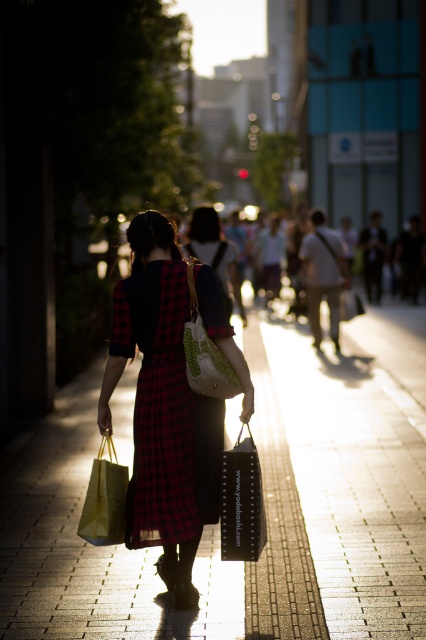
Question: Among these objects, which one is farthest from the camera?

Choices:
 (A) green textured fabric handbag at center
 (B) yellow paper shopping bag at lower left

Answer: (A)

Question: Which point is farther to the camera?

Choices:
 (A) red plaid dress at center
 (B) brick pavement at center
 (C) green textured fabric handbag at center

Answer: (A)

Question: In this image, where is red plaid dress at center located relative to yellow paper shopping bag at lower left?

Choices:
 (A) left
 (B) right

Answer: (B)

Question: Which object appears farthest from the camera in this image?

Choices:
 (A) black matte shopping bag at center
 (B) yellow paper shopping bag at lower left

Answer: (B)

Question: Can you confirm if brick pavement at center is positioned above green textured fabric handbag at center?

Choices:
 (A) no
 (B) yes

Answer: (A)

Question: Does black matte shopping bag at center lie behind green textured fabric handbag at center?

Choices:
 (A) no
 (B) yes

Answer: (A)